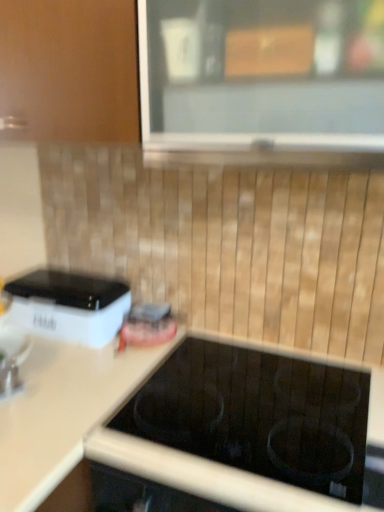
Locate an element on the screen. This screenshot has height=512, width=384. free space in front of metallic faucet at lower left is located at coordinates [x=26, y=410].